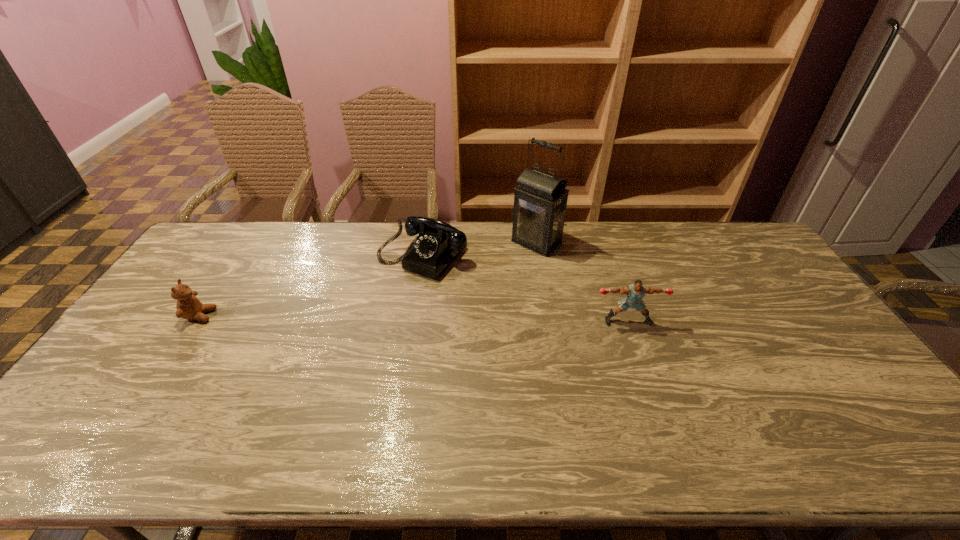
In order to click on blank space at the right edge in this screenshot , I will do `click(755, 278)`.

I want to click on vacant space at the far left corner, so click(x=205, y=239).

At what (x,y) coordinates should I click in order to perform the action: click on free spot at the near right corner of the desktop. Please return your answer as a coordinate pair (x, y). Image resolution: width=960 pixels, height=540 pixels. Looking at the image, I should click on (852, 408).

The height and width of the screenshot is (540, 960). What are the coordinates of `vacant area that lies between the tallest object and the leftmost object` in the screenshot? It's located at (369, 279).

Locate an element on the screen. This screenshot has height=540, width=960. free point between the leftmost object and the lantern is located at coordinates (369, 279).

This screenshot has width=960, height=540. What are the coordinates of `free space between the teddy bear and the telephone` in the screenshot? It's located at tap(311, 285).

Where is `vacant space that is in between the leftmost object and the rightmost object`? This screenshot has height=540, width=960. vacant space that is in between the leftmost object and the rightmost object is located at coordinates (414, 318).

Identify the location of free space between the telephone and the tallest object. Image resolution: width=960 pixels, height=540 pixels. (480, 248).

Where is `free area in between the third object from right to left and the puncher`? This screenshot has width=960, height=540. free area in between the third object from right to left and the puncher is located at coordinates (525, 288).

You are a GUI agent. You are given a task and a screenshot of the screen. Output one action in this format:
    pyautogui.click(x=<x>, y=<y>)
    Task: Click on the free space between the lantern and the rightmost object
    
    Given the screenshot: What is the action you would take?
    pyautogui.click(x=583, y=281)